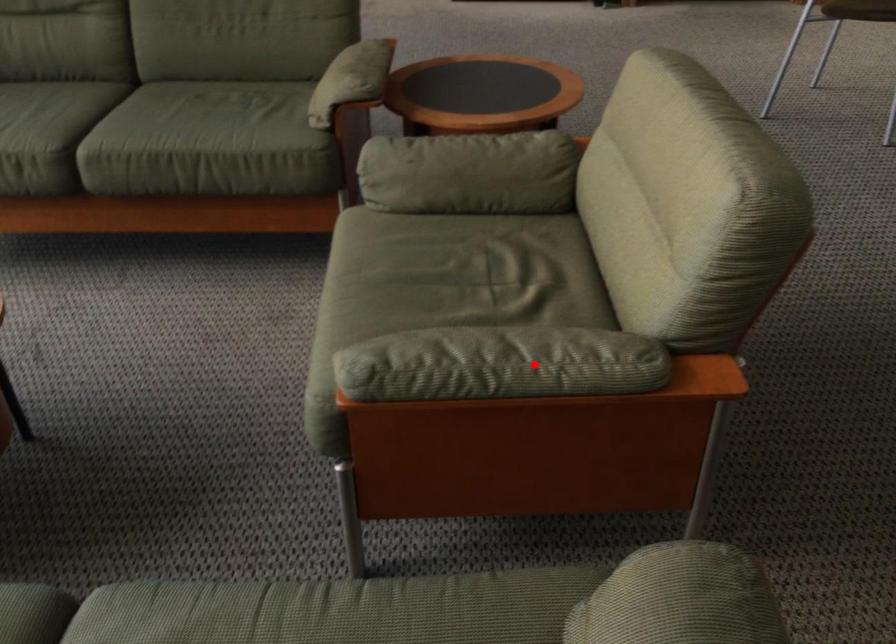
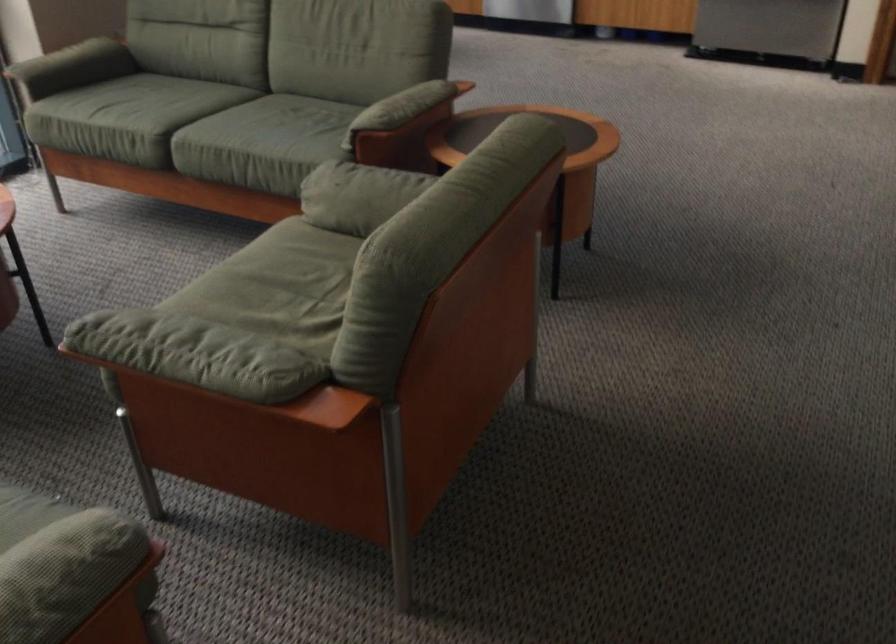
Find the pixel in the second image that matches the highlighted location in the first image.

(195, 354)